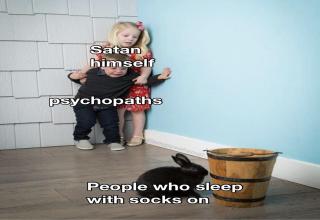
At what (x,y) coordinates should I click in order to perform the action: click on wall. Please return your answer as a coordinate pair (x, y). This screenshot has height=220, width=320. Looking at the image, I should click on (255, 91).